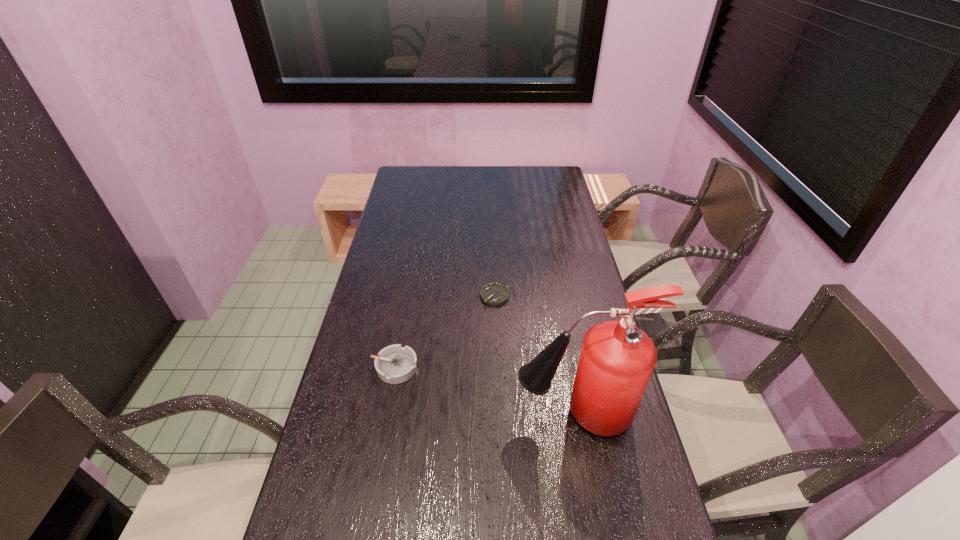
Find the location of `unoccupied area between the leftmost object and the fire extinguisher`. unoccupied area between the leftmost object and the fire extinguisher is located at coordinates (485, 390).

Where is `vacant region between the taller ashtray and the tallest object`? Image resolution: width=960 pixels, height=540 pixels. vacant region between the taller ashtray and the tallest object is located at coordinates (485, 390).

Where is `vacant point located between the farther ashtray and the nearest object`? The image size is (960, 540). vacant point located between the farther ashtray and the nearest object is located at coordinates (535, 355).

I want to click on free area in between the farthest object and the leftmost object, so click(x=444, y=332).

Find the location of `empty space that is in between the taller ashtray and the farther ashtray`. empty space that is in between the taller ashtray and the farther ashtray is located at coordinates (444, 332).

Where is `free spot between the left ashtray and the shortest object`? The height and width of the screenshot is (540, 960). free spot between the left ashtray and the shortest object is located at coordinates (444, 332).

At what (x,y) coordinates should I click in order to perform the action: click on vacant space that's between the taller ashtray and the right ashtray. Please return your answer as a coordinate pair (x, y). Image resolution: width=960 pixels, height=540 pixels. Looking at the image, I should click on (444, 332).

The width and height of the screenshot is (960, 540). What are the coordinates of `empty location between the shorter ashtray and the left ashtray` in the screenshot? It's located at (444, 332).

Identify the location of the second closest object relative to the right ashtray. (617, 358).

You are a GUI agent. You are given a task and a screenshot of the screen. Output one action in this format:
    pyautogui.click(x=<x>, y=<y>)
    Task: Click on the closest object to the nearest object
    The image size is (960, 540).
    Given the screenshot: What is the action you would take?
    pyautogui.click(x=395, y=364)